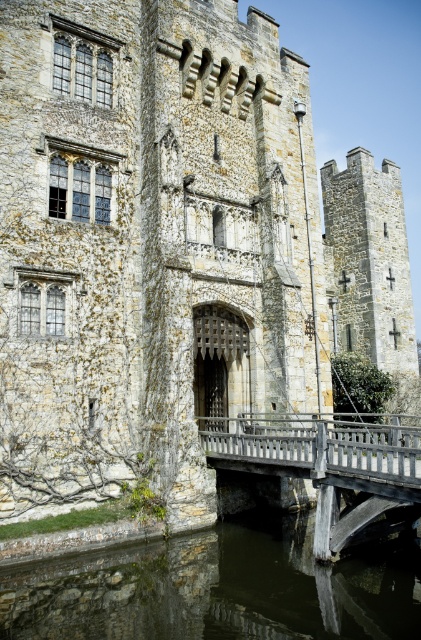
You are a visitor approaching the castle via the wooden bridge. You want to know where the dark stone water at lower center is located relative to your path. Can you describe its position using the coordinate system provided?

The dark stone water at lower center is located at coordinate point (215,589), which means it is positioned near the lower part of the image, slightly to the right of the center. Since you are approaching via the wooden bridge, this coordinate places the water in the foreground, likely under the bridge or near the moat area.

You are a knight approaching the castle entrance. You see the dark stone water at lower center and the wooden bridge at center. Which object is nearer to you as you stand at the base of the bridge?

The dark stone water at lower center is closer to the viewer than the wooden bridge at center, so the dark stone water at lower center is nearer to you.